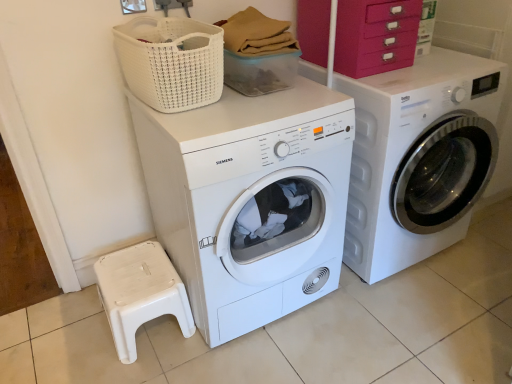
Identify the location of vacant space in between white glossy washing machine at right, which appears as the 1th washing machine when viewed from the right, and white matte washing machine at center, which is the 1th washing machine from left to right. This screenshot has width=512, height=384. (318, 322).